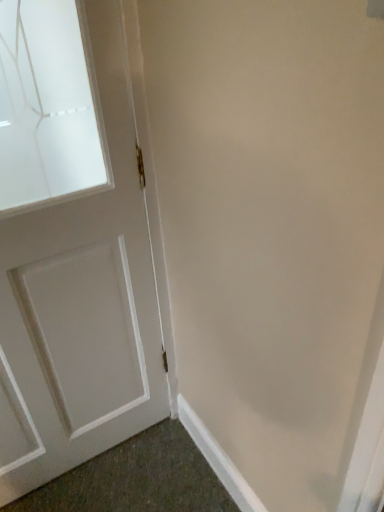
What do you see at coordinates (72, 245) in the screenshot? I see `white painted wood door at left` at bounding box center [72, 245].

Where is `white painted wood door at left`? white painted wood door at left is located at coordinates [72, 245].

This screenshot has width=384, height=512. Identify the location of white painted wood door at left. 72,245.